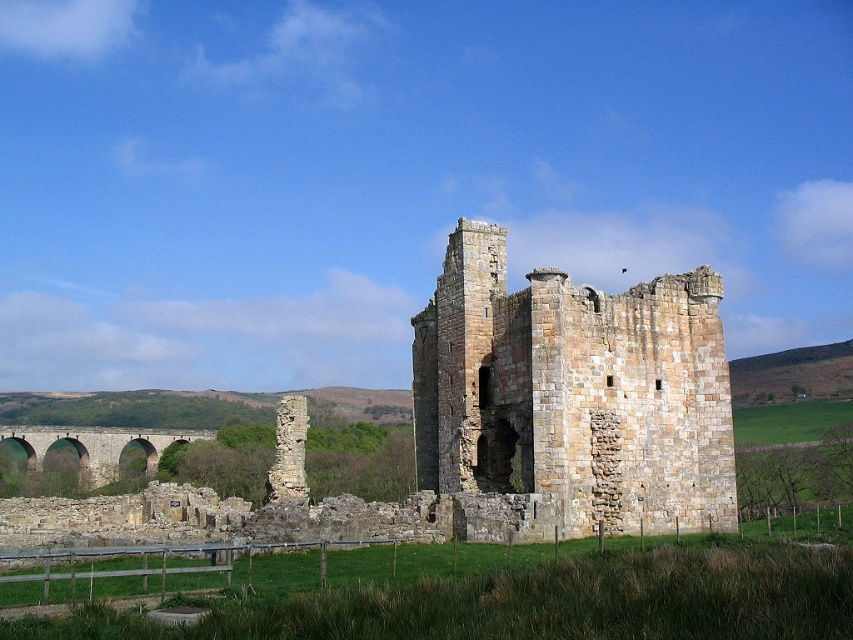
Question: Which object is closer to the camera taking this photo?

Choices:
 (A) brown stone viaduct at lower left
 (B) stone ruins at center

Answer: (B)

Question: Where is stone ruins at center located in relation to brown stone viaduct at lower left in the image?

Choices:
 (A) left
 (B) right

Answer: (B)

Question: Which of the following is the farthest from the observer?

Choices:
 (A) brown stone viaduct at lower left
 (B) stone ruins at center

Answer: (A)

Question: Is stone ruins at center closer to the viewer compared to brown stone viaduct at lower left?

Choices:
 (A) yes
 (B) no

Answer: (A)

Question: Is stone ruins at center wider than brown stone viaduct at lower left?

Choices:
 (A) yes
 (B) no

Answer: (B)

Question: Which point is closer to the camera?

Choices:
 (A) (107, 429)
 (B) (416, 426)

Answer: (B)